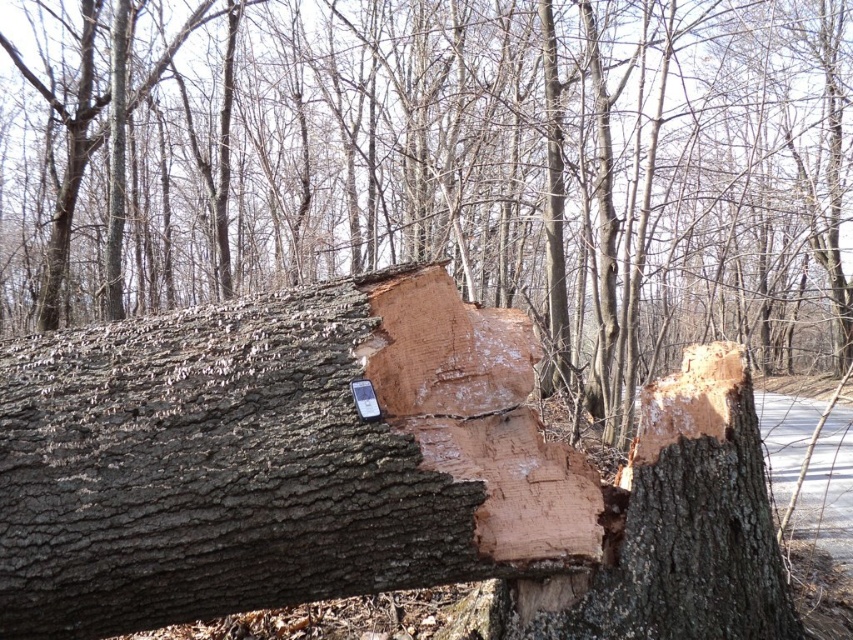
Does smooth brown log at center have a larger size compared to light brown wood at center?

Yes.

Which is behind, point (381, 106) or point (732, 413)?

Point (381, 106)

Is point (157, 160) farther from viewer compared to point (666, 460)?

Yes, point (157, 160) is behind point (666, 460).

You are a GUI agent. You are given a task and a screenshot of the screen. Output one action in this format:
    pyautogui.click(x=<x>, y=<y>)
    Task: Click on the smooth brown log at center
    The width and height of the screenshot is (853, 640).
    Given the screenshot: What is the action you would take?
    pyautogui.click(x=447, y=168)